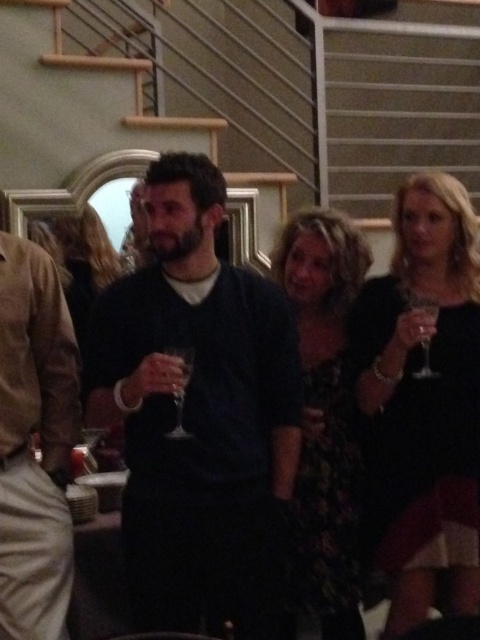
Can you confirm if dark blue sweater at center is thinner than matte black sweater at center?

No.

Can you confirm if dark blue sweater at center is taller than matte black sweater at center?

Correct, dark blue sweater at center is much taller as matte black sweater at center.

Is point (288, 380) positioned behind point (16, 324)?

Yes, point (288, 380) is farther from viewer.

Find the location of a particular element. The image size is (480, 640). dark blue sweater at center is located at coordinates (199, 413).

Does floral dress at center have a larger size compared to clear glass wine glass at right?

Yes.

Can you confirm if floral dress at center is positioned below clear glass wine glass at right?

Indeed, floral dress at center is positioned under clear glass wine glass at right.

Is point (278, 269) behind point (437, 305)?

Yes, point (278, 269) is farther from viewer.

Locate an element on the screen. The width and height of the screenshot is (480, 640). floral dress at center is located at coordinates (324, 420).

Which is in front, point (277, 358) or point (424, 353)?

Point (277, 358) is in front.

Can you confirm if dark blue sweater at center is smaller than clear glass wine glass at right?

Actually, dark blue sweater at center might be larger than clear glass wine glass at right.

Where is `dark blue sweater at center`? The image size is (480, 640). dark blue sweater at center is located at coordinates (199, 413).